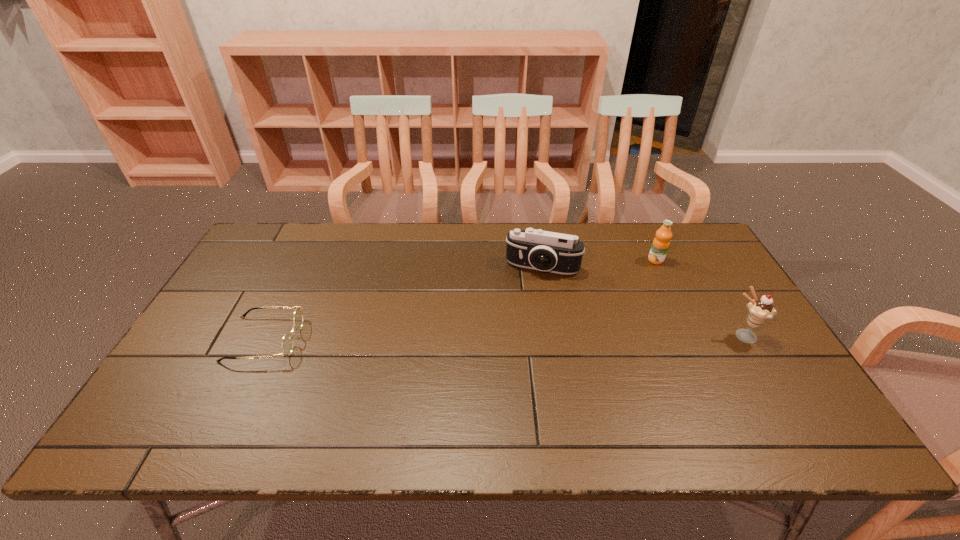
At what (x,y) coordinates should I click in order to perform the action: click on vacant space on the desktop that is between the shortest object and the rightmost object and is positioned on the front lens of the camera. Please return your answer as a coordinate pair (x, y). This screenshot has width=960, height=540. Looking at the image, I should click on (523, 338).

Find the location of a particular element. The image size is (960, 540). vacant spot on the desktop that is between the leftmost object and the rightmost object and is positioned on the label of the third object from left to right is located at coordinates (533, 338).